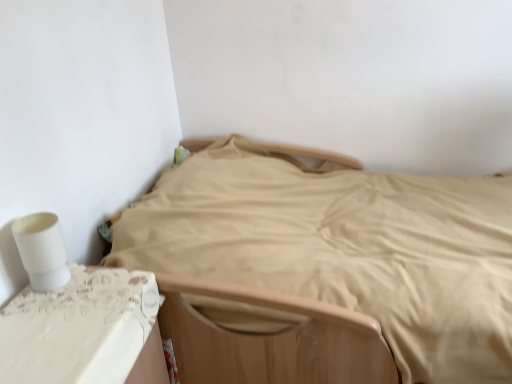
Question: Is white matte toilet paper at left to the right of white lace table at lower left from the viewer's perspective?

Choices:
 (A) no
 (B) yes

Answer: (A)

Question: Is white lace table at lower left a part of white matte toilet paper at left?

Choices:
 (A) yes
 (B) no

Answer: (B)

Question: Considering the relative sizes of white matte toilet paper at left and white lace table at lower left in the image provided, is white matte toilet paper at left shorter than white lace table at lower left?

Choices:
 (A) no
 (B) yes

Answer: (B)

Question: From the image's perspective, is white matte toilet paper at left located beneath white lace table at lower left?

Choices:
 (A) no
 (B) yes

Answer: (A)

Question: Is the position of white matte toilet paper at left more distant than that of white lace table at lower left?

Choices:
 (A) yes
 (B) no

Answer: (A)

Question: Is white matte toilet paper at left taller or shorter than beige fabric bed at center?

Choices:
 (A) tall
 (B) short

Answer: (B)

Question: Visually, is white matte toilet paper at left positioned to the left or to the right of beige fabric bed at center?

Choices:
 (A) left
 (B) right

Answer: (A)

Question: Considering the positions of point (57, 233) and point (497, 246), is point (57, 233) closer or farther from the camera than point (497, 246)?

Choices:
 (A) closer
 (B) farther

Answer: (A)

Question: From the image's perspective, is white matte toilet paper at left located above or below beige fabric bed at center?

Choices:
 (A) below
 (B) above

Answer: (B)

Question: From the image's perspective, is beige fabric bed at center positioned above or below white matte toilet paper at left?

Choices:
 (A) below
 (B) above

Answer: (A)

Question: Considering the positions of point (417, 274) and point (55, 228), is point (417, 274) closer or farther from the camera than point (55, 228)?

Choices:
 (A) farther
 (B) closer

Answer: (A)

Question: Looking at their shapes, would you say beige fabric bed at center is wider or thinner than white matte toilet paper at left?

Choices:
 (A) thin
 (B) wide

Answer: (B)

Question: From a real-world perspective, relative to white matte toilet paper at left, is beige fabric bed at center vertically above or below?

Choices:
 (A) below
 (B) above

Answer: (A)

Question: Choose the correct answer: Is white lace table at lower left inside beige fabric bed at center or outside it?

Choices:
 (A) inside
 (B) outside

Answer: (B)

Question: Considering the positions of white lace table at lower left and beige fabric bed at center in the image, is white lace table at lower left wider or thinner than beige fabric bed at center?

Choices:
 (A) wide
 (B) thin

Answer: (B)